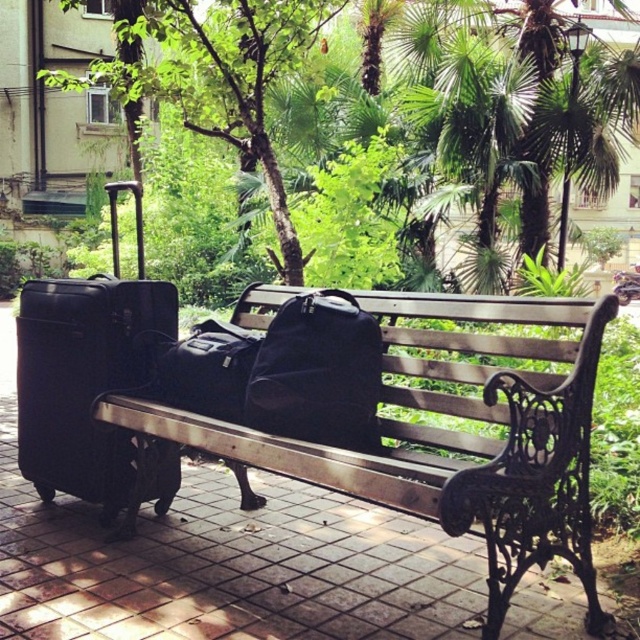
Can you confirm if matte black duffel bag at center is shorter than matte black backpack at center?

No.

Can you confirm if matte black duffel bag at center is taller than matte black backpack at center?

Indeed, matte black duffel bag at center has a greater height compared to matte black backpack at center.

Does point (352, 403) come farther from viewer compared to point (198, 323)?

No, (352, 403) is closer to viewer.

The width and height of the screenshot is (640, 640). What are the coordinates of `matte black duffel bag at center` in the screenshot? It's located at (317, 372).

Between black matte suitcase at left and green leafy tree at upper center, which one is positioned lower?

black matte suitcase at left is below.

Between point (84, 442) and point (198, 92), which one is positioned in front?

Point (84, 442) is more forward.

Who is more forward, (20,458) or (195,74)?

Positioned in front is point (20,458).

The width and height of the screenshot is (640, 640). I want to click on black matte suitcase at left, so click(x=86, y=371).

Is black matte suitcase at left taller than matte black duffel bag at center?

Yes.

Is black matte suitcase at left above matte black duffel bag at center?

Correct, black matte suitcase at left is located above matte black duffel bag at center.

Image resolution: width=640 pixels, height=640 pixels. What do you see at coordinates (86, 371) in the screenshot?
I see `black matte suitcase at left` at bounding box center [86, 371].

The image size is (640, 640). Find the location of `black matte suitcase at left`. black matte suitcase at left is located at coordinates (86, 371).